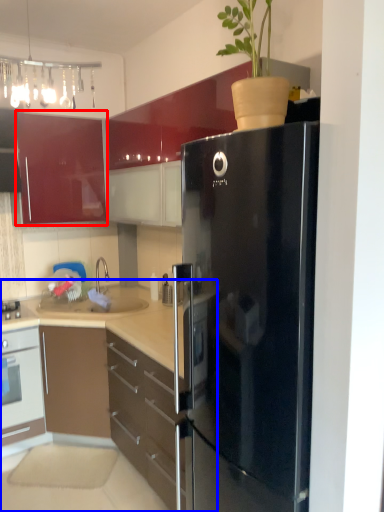
Question: Which point is closer to the camera, cabinetry (highlighted by a red box) or cabinetry (highlighted by a blue box)?

Choices:
 (A) cabinetry
 (B) cabinetry

Answer: (B)